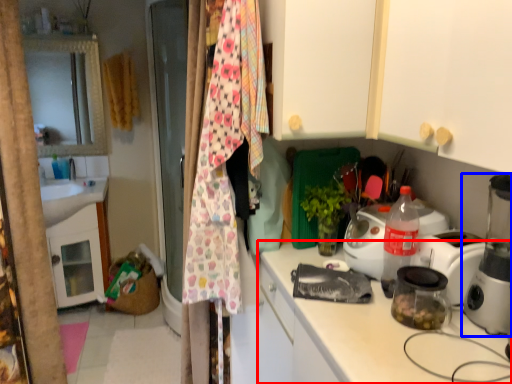
Question: Which object is further to the camera taking this photo, countertop (highlighted by a red box) or home appliance (highlighted by a blue box)?

Choices:
 (A) countertop
 (B) home appliance

Answer: (B)